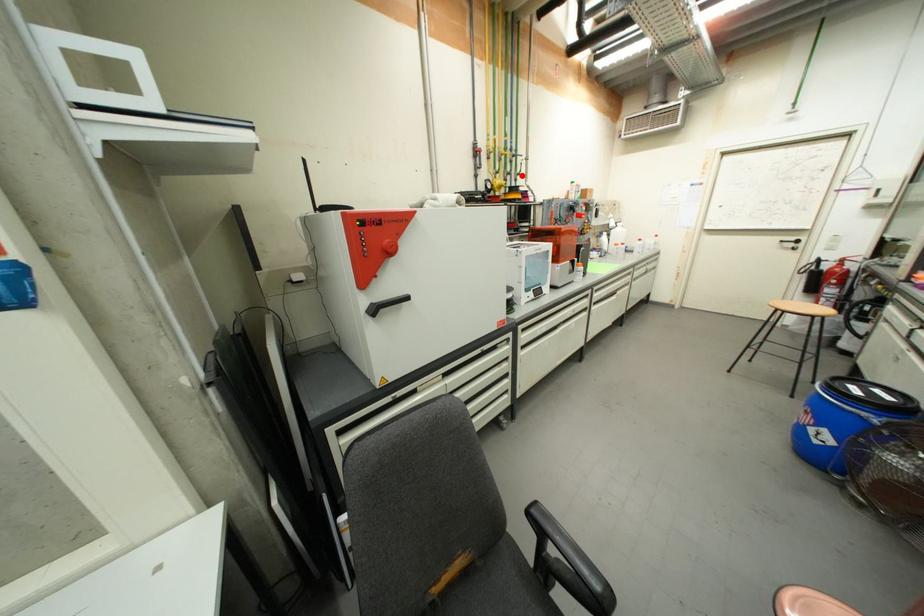
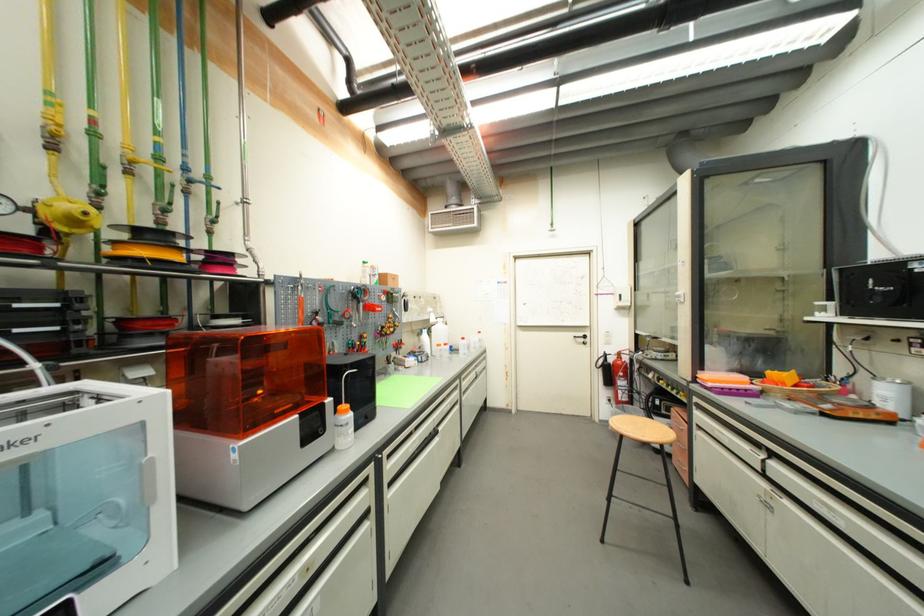
In the second image, find the point that corresponds to the highlighted location in the first image.

(213, 222)